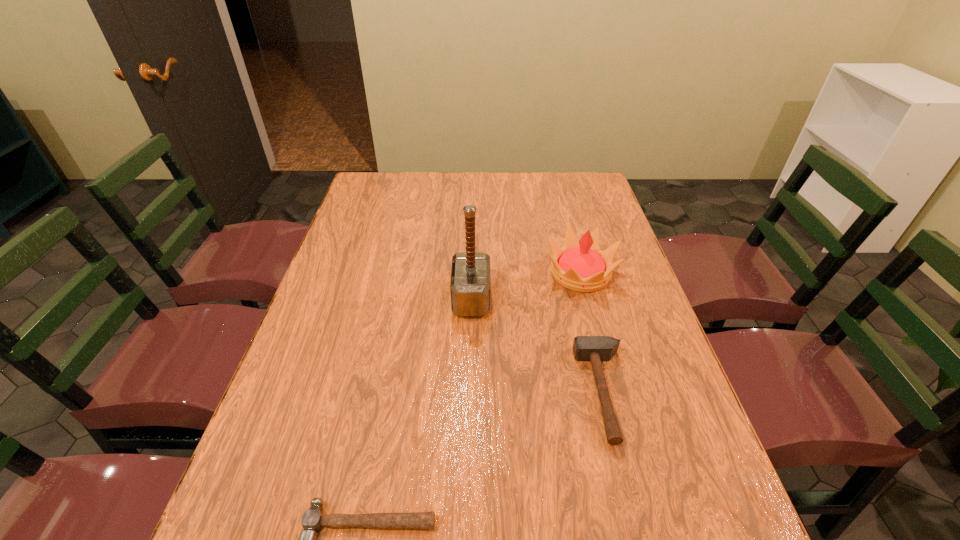
Where is `vacant point located between the crown and the second hammer from left to right`? The height and width of the screenshot is (540, 960). vacant point located between the crown and the second hammer from left to right is located at coordinates click(x=526, y=286).

Locate an element on the screen. The width and height of the screenshot is (960, 540). unoccupied area between the tallest object and the second tallest hammer is located at coordinates (538, 346).

This screenshot has height=540, width=960. I want to click on object that ranks as the second closest to the second hammer from right to left, so click(x=585, y=348).

This screenshot has height=540, width=960. Find the location of `object identified as the second closest to the rightmost hammer`. object identified as the second closest to the rightmost hammer is located at coordinates (470, 287).

Locate which hammer is the second closest to the leftmost object. Please provide its 2D coordinates. Your answer should be formatted as a tuple, i.e. [(x, y)], where the tuple contains the x and y coordinates of a point satisfying the conditions above.

[(470, 287)]

Select which hammer appears as the second closest to the second farthest hammer. Please provide its 2D coordinates. Your answer should be formatted as a tuple, i.e. [(x, y)], where the tuple contains the x and y coordinates of a point satisfying the conditions above.

[(312, 520)]